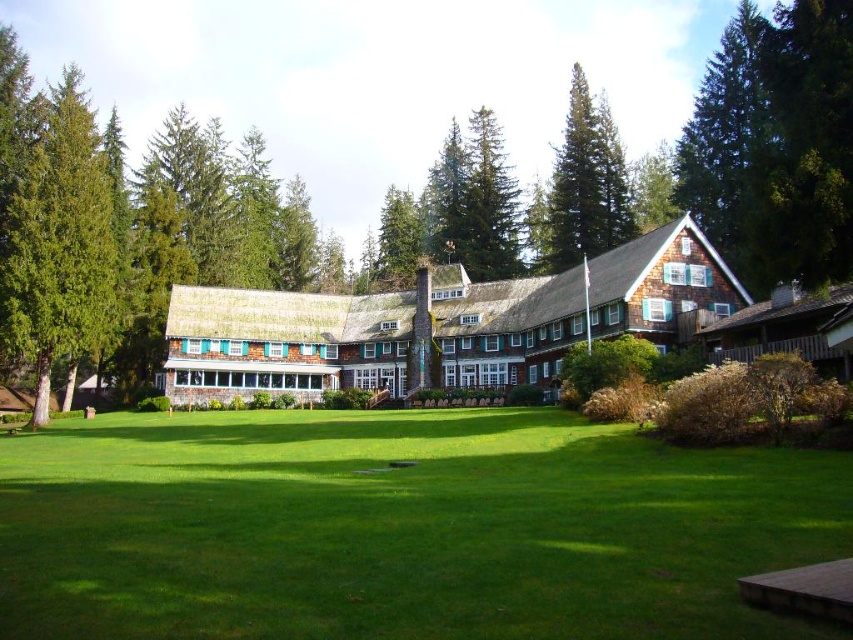
Question: Which point is farther to the camera?

Choices:
 (A) (61, 182)
 (B) (654, 506)

Answer: (A)

Question: Based on their relative distances, which object is nearer to the green shaggy pine at upper center?

Choices:
 (A) green textured tree at left
 (B) green textured tree at center
 (C) brown shingles at center

Answer: (B)

Question: Can you confirm if green textured tree at center is positioned above brown shingles at center?

Choices:
 (A) yes
 (B) no

Answer: (A)

Question: Is green grass at center smaller than green textured tree at left?

Choices:
 (A) yes
 (B) no

Answer: (A)

Question: Can you confirm if green grass at center is thinner than green shaggy pine at upper center?

Choices:
 (A) no
 (B) yes

Answer: (A)

Question: Which object is farther from the camera taking this photo?

Choices:
 (A) green textured tree at left
 (B) green shaggy pine at upper center
 (C) brown shingles at center
 (D) green textured tree at center

Answer: (B)